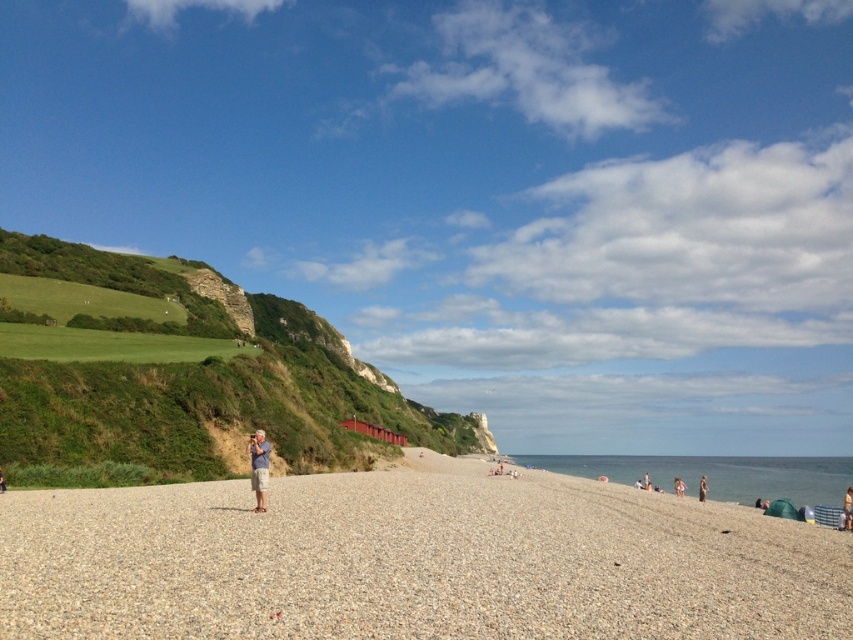
Question: Is light brown fabric shorts at center further to the viewer compared to light brown fabric bag at lower right?

Choices:
 (A) yes
 (B) no

Answer: (B)

Question: Where is smooth gravel beach at center located in relation to light brown fabric bag at lower right in the image?

Choices:
 (A) below
 (B) above

Answer: (B)

Question: Which of the following is the farthest from the observer?

Choices:
 (A) (257, 452)
 (B) (705, 499)
 (C) (51, 440)
 (D) (844, 528)

Answer: (B)

Question: Which of the following is the farthest from the observer?

Choices:
 (A) (57, 509)
 (B) (699, 483)

Answer: (B)

Question: Which object appears closest to the camera in this image?

Choices:
 (A) brown fabric person at lower right
 (B) light brown fabric bag at lower right

Answer: (B)

Question: Is light brown fabric bag at lower right to the left of light brown sand at lower right from the viewer's perspective?

Choices:
 (A) no
 (B) yes

Answer: (A)